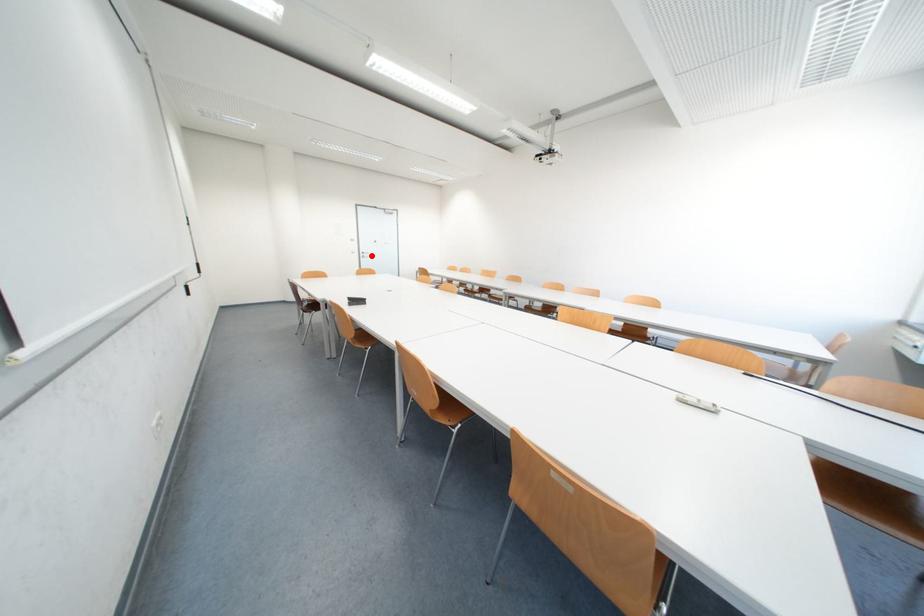
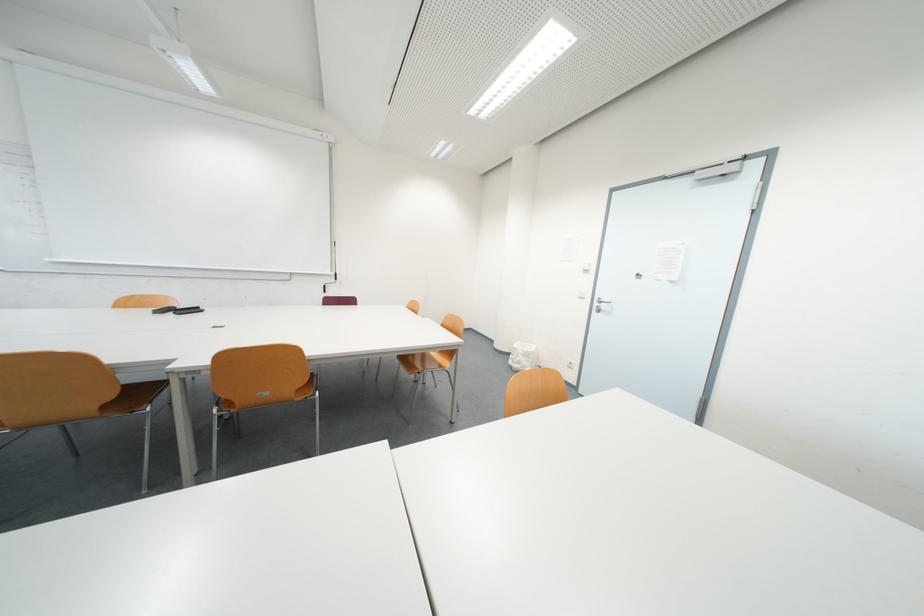
The point at the highlighted location is marked in the first image. Where is the corresponding point in the second image?

(605, 305)